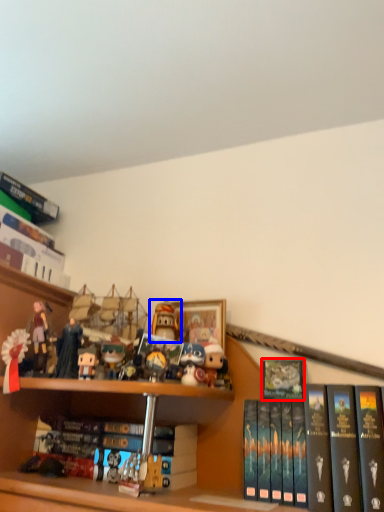
Question: Which object appears farthest to the camera in this image, book (highlighted by a red box) or toy (highlighted by a blue box)?

Choices:
 (A) book
 (B) toy

Answer: (B)